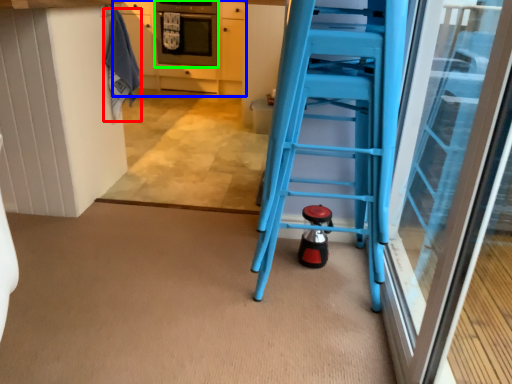
Question: Which object is the farthest from laundry (highlighted by a red box)? Choose among these: cabinetry (highlighted by a blue box) or oven (highlighted by a green box).

Choices:
 (A) cabinetry
 (B) oven

Answer: (B)